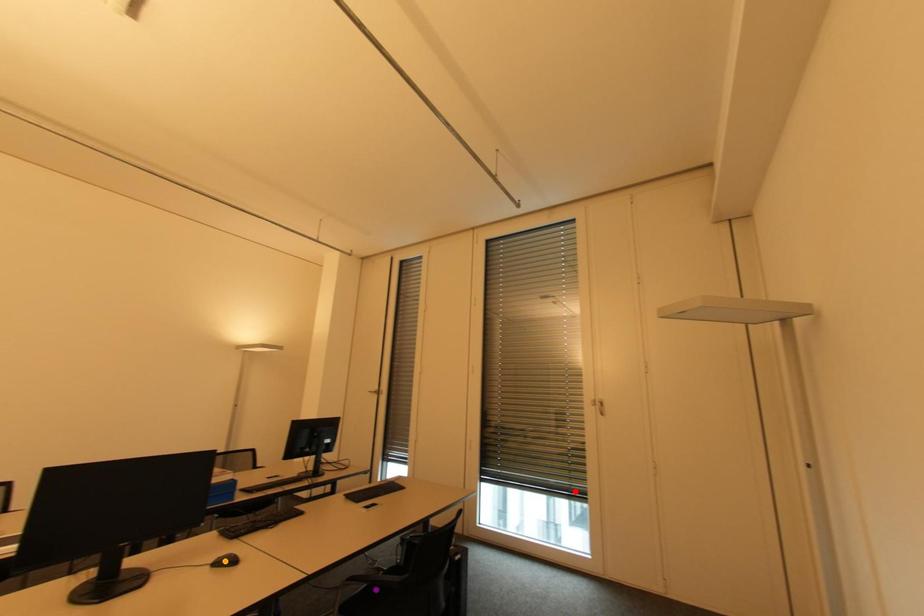
Order these from nearest to farthest:
red point
orange point
purple point

red point
purple point
orange point